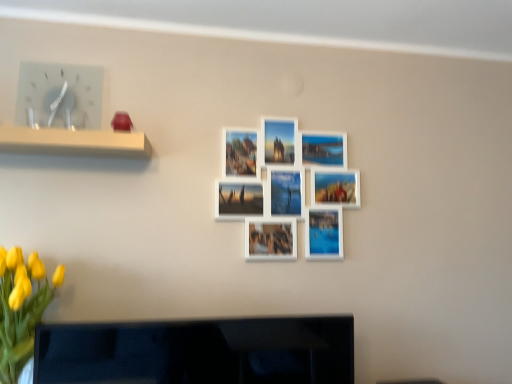
Question: From a real-world perspective, is yellow matte flowers at lower left positioned under black glossy tv at lower center based on gravity?

Choices:
 (A) yes
 (B) no

Answer: (B)

Question: Does yellow matte flowers at lower left contain black glossy tv at lower center?

Choices:
 (A) no
 (B) yes

Answer: (A)

Question: From a real-world perspective, is yellow matte flowers at lower left on black glossy tv at lower center?

Choices:
 (A) no
 (B) yes

Answer: (B)

Question: Does yellow matte flowers at lower left have a lesser width compared to black glossy tv at lower center?

Choices:
 (A) yes
 (B) no

Answer: (B)

Question: From the image's perspective, is yellow matte flowers at lower left located beneath black glossy tv at lower center?

Choices:
 (A) yes
 (B) no

Answer: (B)

Question: Considering the relative sizes of yellow matte flowers at lower left and black glossy tv at lower center in the image provided, is yellow matte flowers at lower left bigger than black glossy tv at lower center?

Choices:
 (A) yes
 (B) no

Answer: (A)

Question: Does white plastic clock at upper left have a lesser width compared to yellow matte flowers at lower left?

Choices:
 (A) yes
 (B) no

Answer: (A)

Question: Considering the relative positions of white plastic clock at upper left and yellow matte flowers at lower left in the image provided, is white plastic clock at upper left to the right of yellow matte flowers at lower left from the viewer's perspective?

Choices:
 (A) no
 (B) yes

Answer: (A)

Question: Is white plastic clock at upper left taller than yellow matte flowers at lower left?

Choices:
 (A) no
 (B) yes

Answer: (A)

Question: Can you confirm if white plastic clock at upper left is shorter than yellow matte flowers at lower left?

Choices:
 (A) yes
 (B) no

Answer: (A)

Question: Is white plastic clock at upper left oriented away from yellow matte flowers at lower left?

Choices:
 (A) yes
 (B) no

Answer: (B)

Question: Considering the relative sizes of white plastic clock at upper left and yellow matte flowers at lower left in the image provided, is white plastic clock at upper left smaller than yellow matte flowers at lower left?

Choices:
 (A) no
 (B) yes

Answer: (B)

Question: Is white plastic clock at upper left not within black glossy tv at lower center?

Choices:
 (A) no
 (B) yes

Answer: (B)